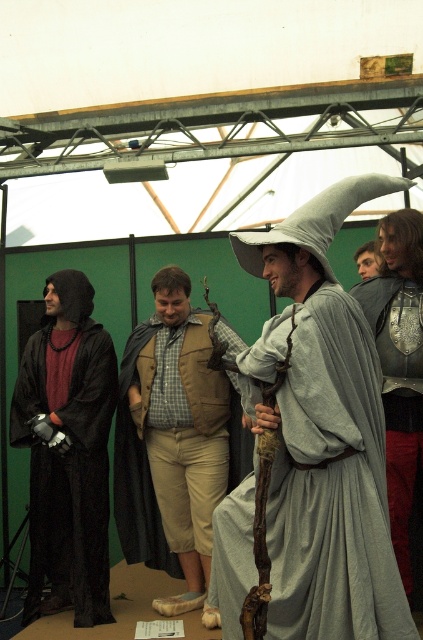
Question: Which object is closer to the camera taking this photo?

Choices:
 (A) gray fabric wizard hat at center
 (B) smooth silver helmet at center
 (C) matte black robe at left
 (D) metallic silver armor at right

Answer: (A)

Question: Can you confirm if gray fabric wizard hat at center is positioned to the right of smooth silver helmet at center?

Choices:
 (A) yes
 (B) no

Answer: (B)

Question: Does gray fabric wizard hat at center appear over smooth silver helmet at center?

Choices:
 (A) no
 (B) yes

Answer: (A)

Question: Can you confirm if metallic silver armor at right is positioned above smooth silver helmet at center?

Choices:
 (A) no
 (B) yes

Answer: (A)

Question: Which object is farther from the camera taking this photo?

Choices:
 (A) metallic silver armor at right
 (B) matte black robe at left
 (C) smooth silver helmet at center
 (D) gray fabric wizard hat at center

Answer: (B)

Question: Among these points, which one is farthest from the camera?

Choices:
 (A) (184, 275)
 (B) (76, 408)

Answer: (A)